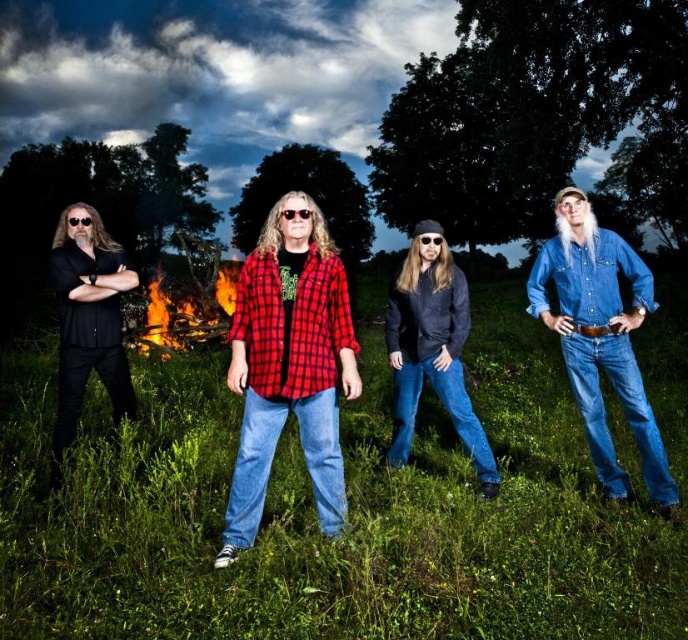
You are organizing a clothing donation drive and need to determine which of the two items, the red plaid flannel shirt at center or the black matte shirt at left, can fit into a standard donation box that accommodates items up to 30 cm in width. Based on their widths, which one is more likely to fit?

The red plaid flannel shirt at center has a lesser width compared to the black matte shirt at left, so the red plaid flannel shirt at center is more likely to fit into the standard donation box that accommodates items up to 30 cm in width.

You are organizing a clothing donation drive and need to determine which of the two items is more suitable for a child. Considering the sizes of the red plaid flannel shirt at center and the black matte shirt at left in the image, which one would you recommend?

The red plaid flannel shirt at center is smaller than the black matte shirt at left, so it would be more suitable for a child.

You are analyzing the composition of the image and need to determine the exact position of the red plaid flannel shirt at center. What are its coordinates?

The red plaid flannel shirt at center is located at coordinates point (290,365).